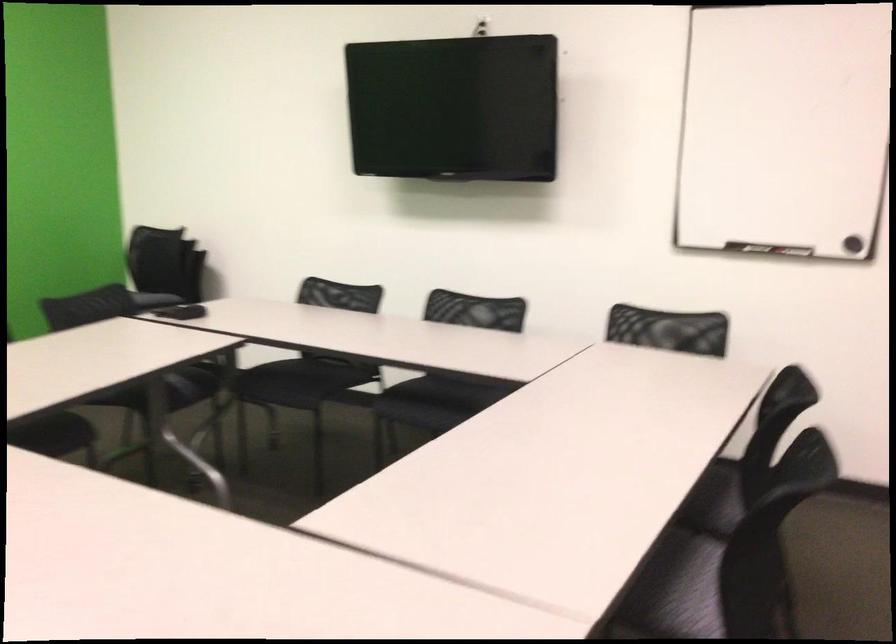
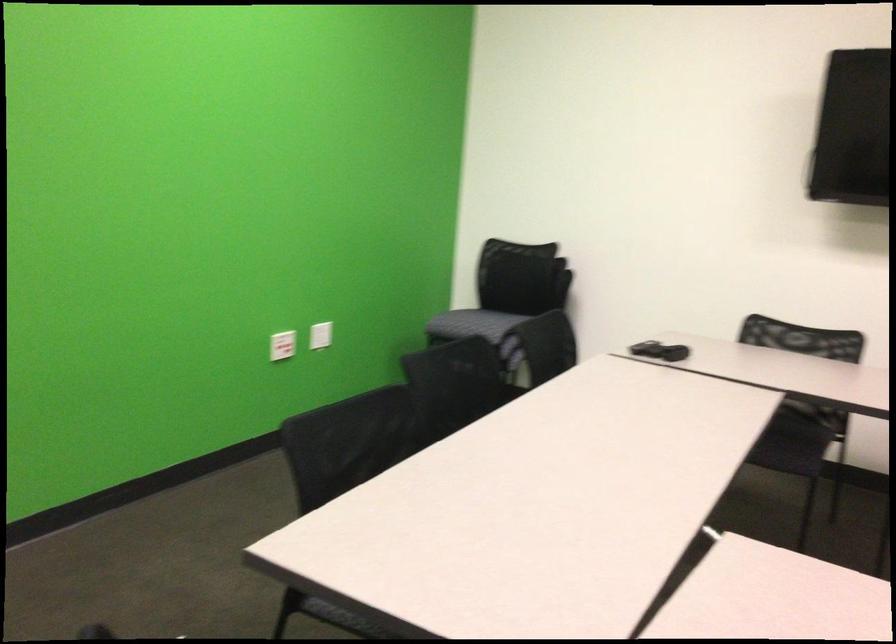
Where in the second image is the point corresponding to point 299,381 from the first image?

(781, 422)